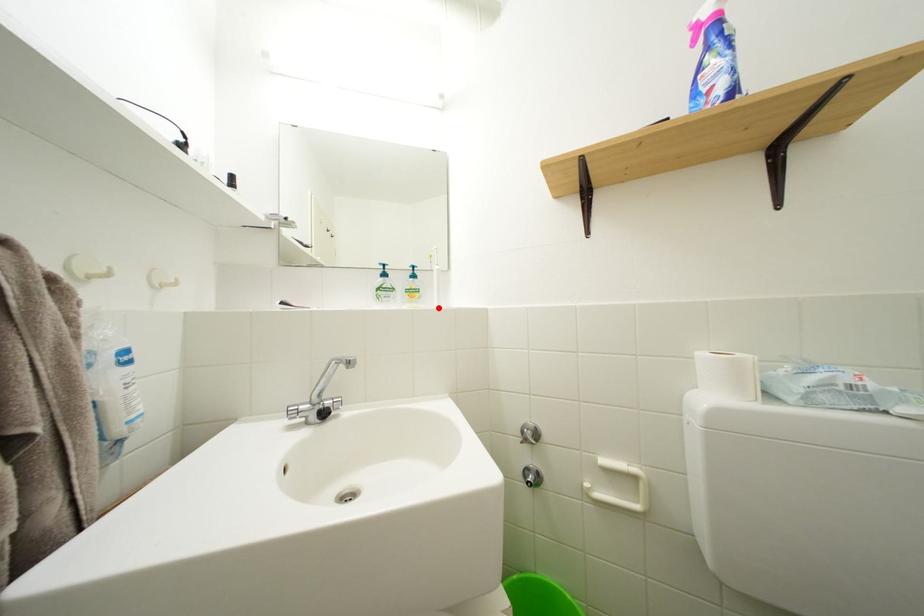
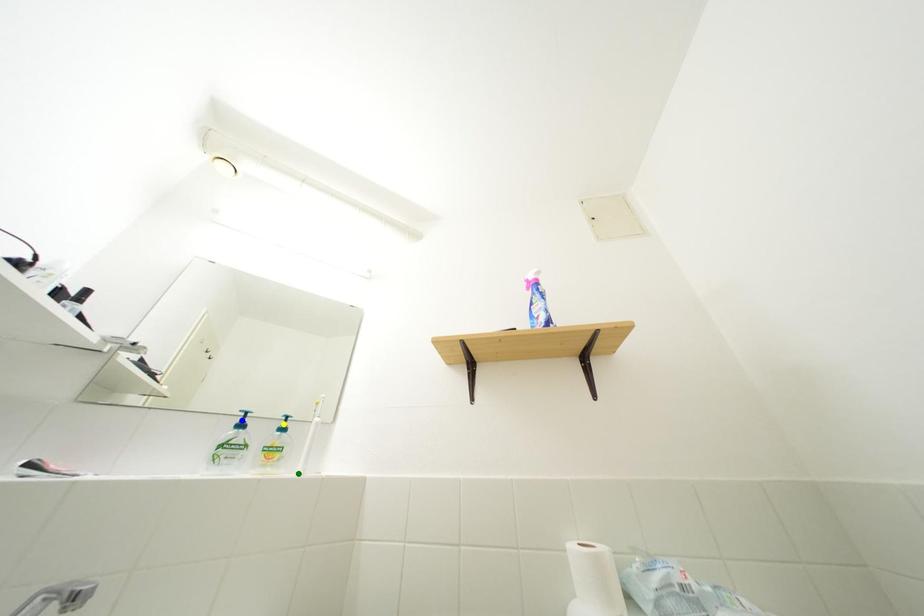
Question: I am providing you with two images of the same scene from different viewpoints. A red point is marked on the first image. You are given multiple points on the second image. Which spot in image 2 lines up with the point in image 1?

Choices:
 (A) yellow point
 (B) green point
 (C) blue point

Answer: (B)